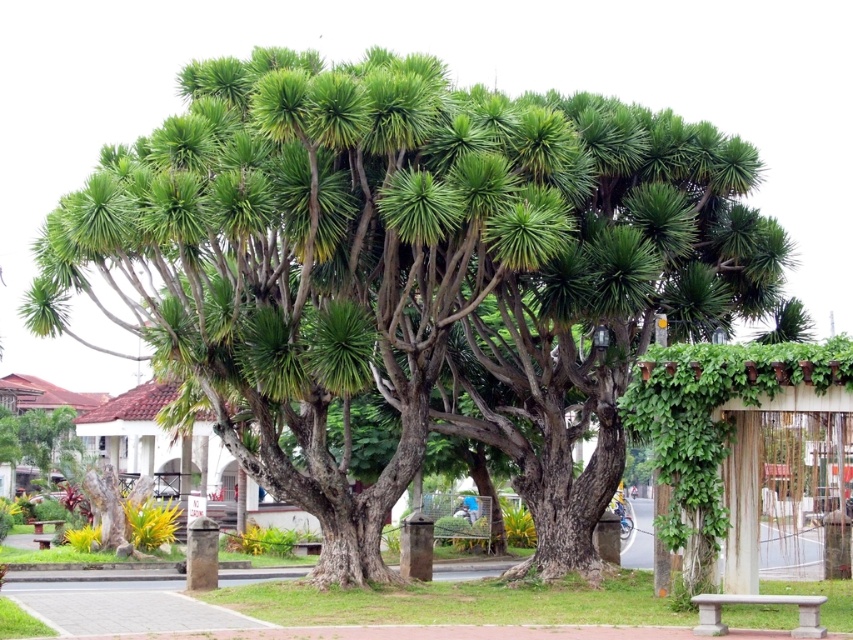
Question: Among these points, which one is farthest from the camera?

Choices:
 (A) (38, 522)
 (B) (721, 624)

Answer: (A)

Question: Does gray concrete bench at lower right appear under wooden bench at lower left?

Choices:
 (A) yes
 (B) no

Answer: (B)

Question: Where is gray concrete bench at lower right located in relation to wooden bench at lower left in the image?

Choices:
 (A) right
 (B) left

Answer: (A)

Question: Among these points, which one is nearest to the camera?

Choices:
 (A) (45, 541)
 (B) (788, 595)

Answer: (B)

Question: In this image, where is gray concrete bench at lower right located relative to wooden bench at lower left?

Choices:
 (A) above
 (B) below

Answer: (A)

Question: Which point is farther to the camera?

Choices:
 (A) wooden bench at lower left
 (B) gray concrete bench at lower right

Answer: (A)